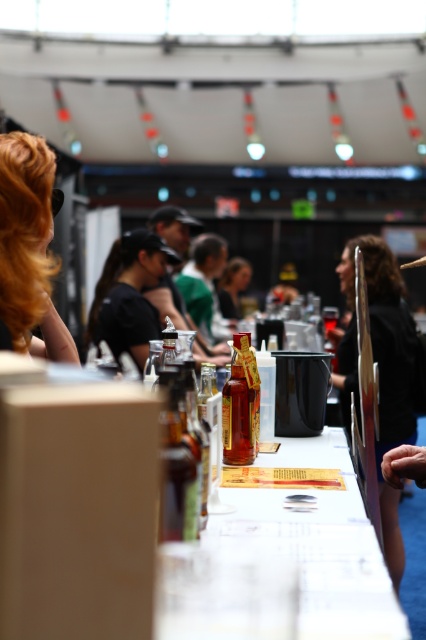
You are a guest at the event and want to grab the translucent glass bottle at center to pour yourself a drink. However, the matte black hair at center is in your way. Can you reach the bottle without moving the hair?

The translucent glass bottle at center is behind matte black hair at center, so you can reach it by moving around the matte black hair at center to access the bottle.

You are a guest at the event and want to grab a drink from the table. You see the matte black hair at center and the translucent glass bottle at center. Which object is closer to you?

The translucent glass bottle at center is closer to you because the matte black hair at center is above it, indicating it is positioned higher and thus farther away.

You are at the tasting event and want to take a photo of both the point at coordinate (400, 611) and the point at coordinate (43, 148). Which point will appear larger in your photo?

Point at coordinate (400, 611) will appear larger in the photo because it is closer to the camera than point at coordinate (43, 148).